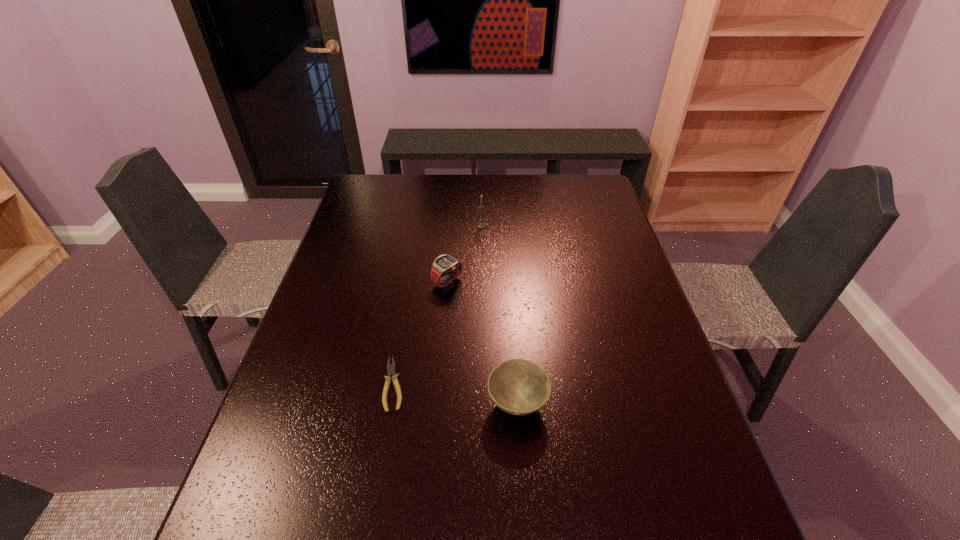
At what (x,y) coordinates should I click in order to perform the action: click on vacant space located 0.110m on the front of the shortest object. Please return your answer as a coordinate pair (x, y). Looking at the image, I should click on coord(381,461).

The image size is (960, 540). In order to click on free space at the far edge of the desktop in this screenshot , I will do (x=560, y=200).

The image size is (960, 540). I want to click on free region at the left edge of the desktop, so click(x=349, y=220).

Identify the location of vacant space at the right edge of the desktop. The width and height of the screenshot is (960, 540). (689, 521).

At what (x,y) coordinates should I click in order to perform the action: click on free space at the far right corner of the desktop. Please return your answer as a coordinate pair (x, y). Image resolution: width=960 pixels, height=540 pixels. Looking at the image, I should click on (600, 181).

Identify the location of free spot between the shortest object and the candle. This screenshot has width=960, height=540. pos(438,305).

Locate an element on the screen. The image size is (960, 540). empty location between the pliers and the candle is located at coordinates click(438, 305).

Find the location of a particular element. unoccupied area between the tallest object and the second object from left to right is located at coordinates (465, 254).

Find the location of a particular element. The image size is (960, 540). empty space between the pliers and the candle is located at coordinates coord(438,305).

This screenshot has height=540, width=960. What are the coordinates of `free space between the shortest object and the bowl` in the screenshot? It's located at (456, 394).